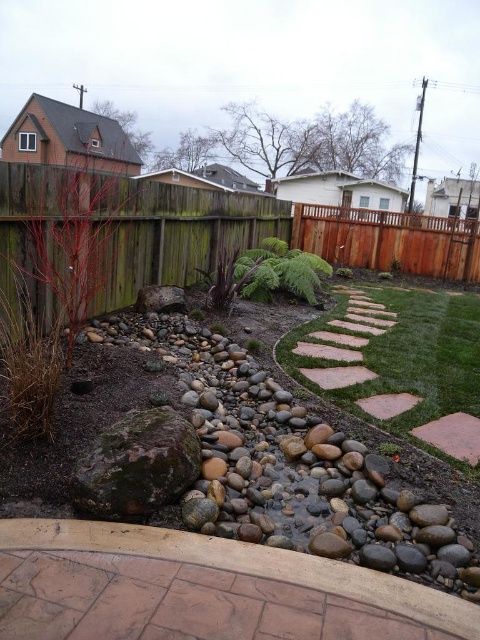
Question: Which object is the farthest from the green grass at center?

Choices:
 (A) brown wood fence at upper right
 (B) green wood fence at left

Answer: (A)

Question: Which object is closer to the camera taking this photo?

Choices:
 (A) brown wood fence at upper right
 (B) green grass at center
 (C) green wood fence at left

Answer: (B)

Question: Can you confirm if green wood fence at left is bigger than green grass at center?

Choices:
 (A) no
 (B) yes

Answer: (B)

Question: Does green wood fence at left appear under brown wood fence at upper right?

Choices:
 (A) yes
 (B) no

Answer: (A)

Question: Estimate the real-world distances between objects in this image. Which object is closer to the green wood fence at left?

Choices:
 (A) brown wood fence at upper right
 (B) green grass at center

Answer: (B)

Question: Does green grass at center have a smaller size compared to brown wood fence at upper right?

Choices:
 (A) yes
 (B) no

Answer: (B)